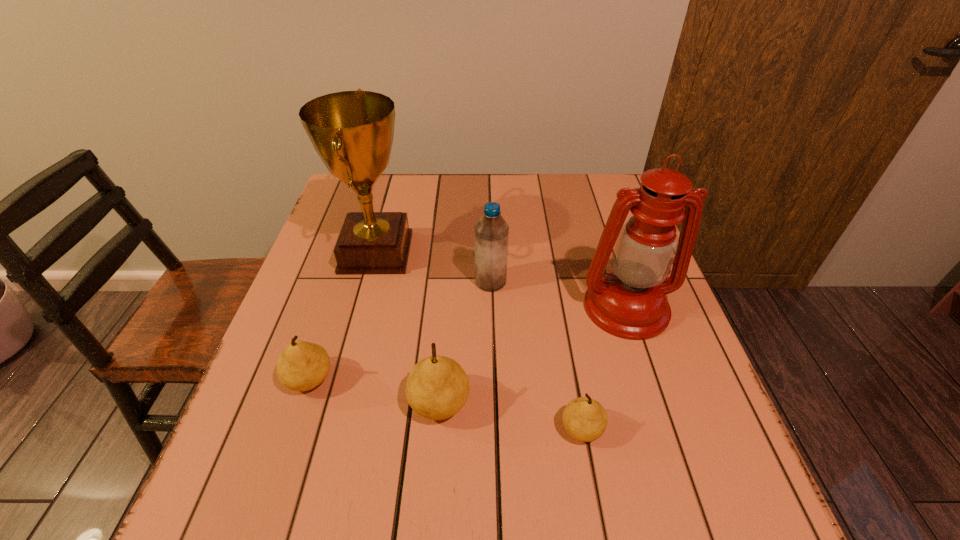
Identify the location of vacant area between the rightmost object and the second pear from left to right. The image size is (960, 540). (533, 355).

Where is `unoccupied position between the leftmost pear and the water bottle`? The width and height of the screenshot is (960, 540). unoccupied position between the leftmost pear and the water bottle is located at coordinates (400, 330).

Identify the location of free area in between the shortest pear and the third shortest object. (511, 416).

Choose which object is the second nearest neighbor to the award. Please provide its 2D coordinates. Your answer should be formatted as a tuple, i.e. [(x, y)], where the tuple contains the x and y coordinates of a point satisfying the conditions above.

[(302, 366)]

You are a GUI agent. You are given a task and a screenshot of the screen. Output one action in this format:
    pyautogui.click(x=<x>, y=<y>)
    Task: Click on the object that is the third closest to the rightmost object
    
    Given the screenshot: What is the action you would take?
    pyautogui.click(x=437, y=387)

This screenshot has width=960, height=540. Find the location of `pear object that ranks as the closest to the water bottle`. pear object that ranks as the closest to the water bottle is located at coordinates (437, 387).

Select which pear appears as the second closest to the shortest pear. Please provide its 2D coordinates. Your answer should be formatted as a tuple, i.e. [(x, y)], where the tuple contains the x and y coordinates of a point satisfying the conditions above.

[(302, 366)]

Locate an element on the screen. Image resolution: width=960 pixels, height=540 pixels. free region that satisfies the following two spatial constraints: 1. on the plaque of the fourth object from right to left; 2. on the right side of the award is located at coordinates (336, 403).

Locate an element on the screen. vacant region that satisfies the following two spatial constraints: 1. on the plaque of the award; 2. on the back side of the second pear from right to left is located at coordinates (336, 403).

Locate an element on the screen. The width and height of the screenshot is (960, 540). free location that satisfies the following two spatial constraints: 1. on the plaque of the award; 2. on the front side of the second tallest pear is located at coordinates (343, 379).